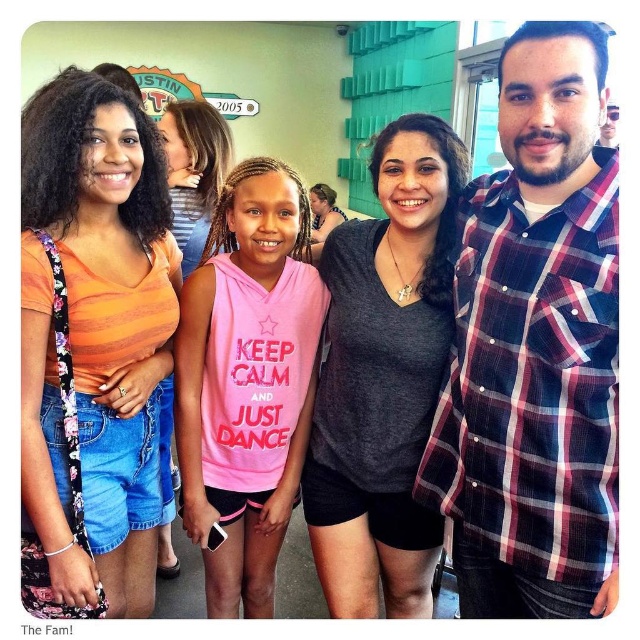
You are a photographer trying to adjust the camera focus. The orange cotton tank top at left and the pink sleeveless hoodie at center are in the frame. Which clothing item should you focus on first if you want to ensure the taller one is sharp?

The orange cotton tank top at left is much taller than the pink sleeveless hoodie at center, so you should focus on the orange cotton tank top at left first to ensure the taller one is sharp.

You are a photographer setting up for a group photo. You have two subjects wearing a dark gray matte shirt at center and a pink cotton hoodie at center. The distance between them is 34.38 inches. If you want to ensure they are spaced exactly 3 feet apart for better composition, should you ask them to move closer or farther apart?

The distance between the dark gray matte shirt at center and the pink cotton hoodie at center is 34.38 inches. Since 3 feet equals 36 inches, they need to move slightly farther apart to reach the desired spacing.